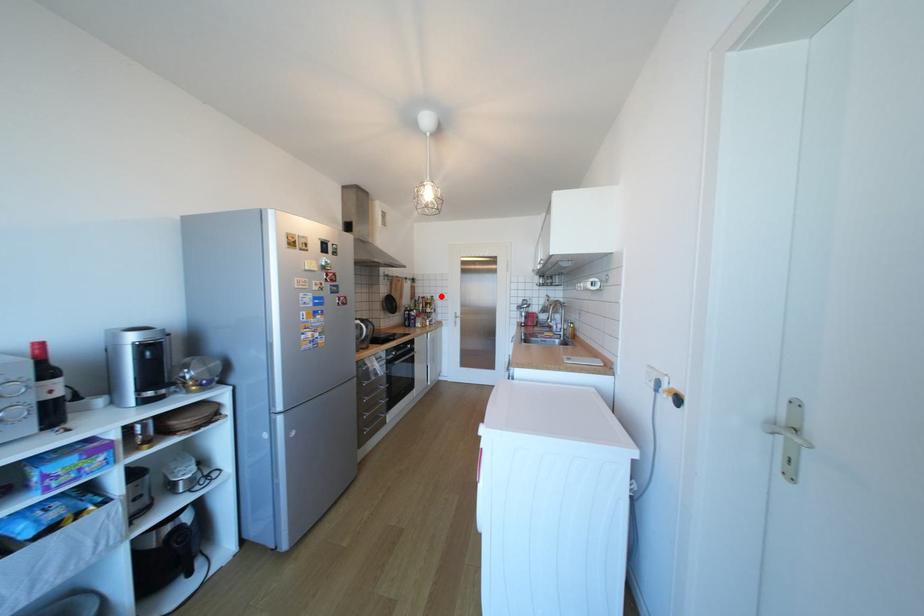
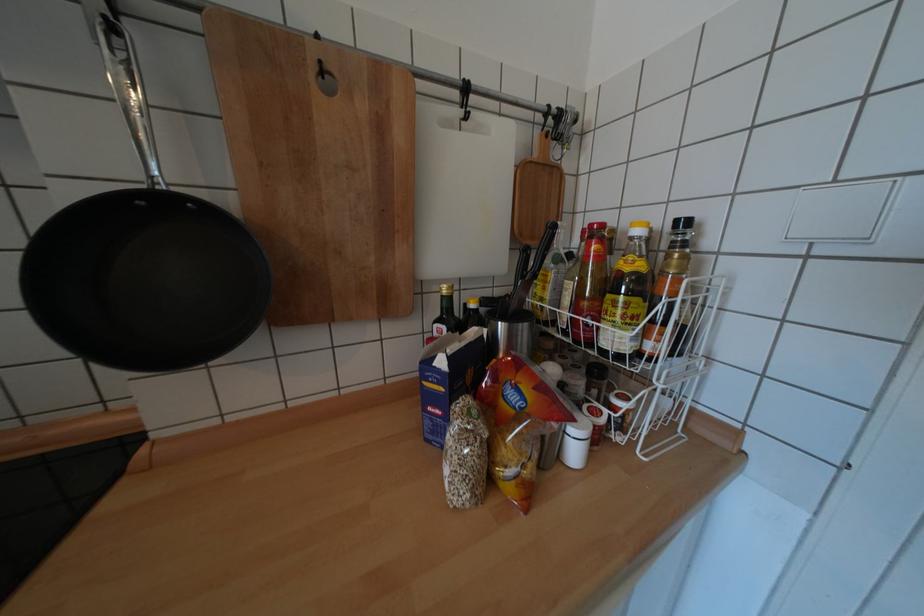
Locate, in the second image, the point that corresponds to the highlighted location in the first image.

(694, 224)